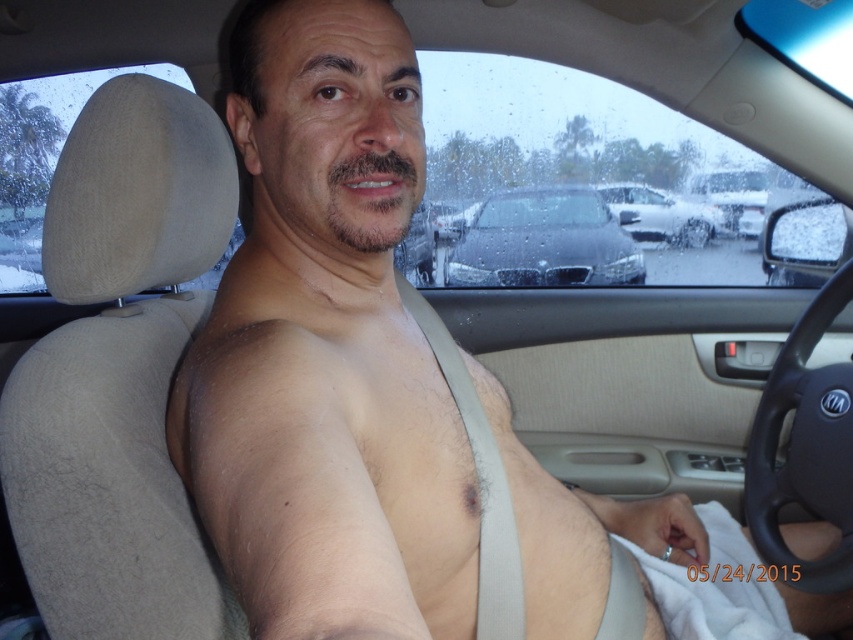
You are a passenger in a car and want to exit through the door on the driver side. There is a black metallic car at center and a white fabric at lower right. Which object is closer to the door handle?

The white fabric at lower right is closer to the door handle because the black metallic car at center is to the right of it, meaning the white fabric is positioned nearer to the door handle.

You are a delivery person who needs to load a package onto a cart that is 6 feet long. You see the white fabric at lower right and the silver metallic sedan at center. Can the cart fit between them without touching either?

The distance between the white fabric at lower right and the silver metallic sedan at center is 7.18 feet, which is greater than the cart length of 6 feet. Therefore, the cart can fit between them without touching either.

In the scene shown: You are a delivery robot positioned at the origin point. You need to navigate to the black metallic car at center. According to the coordinates provided in the Objects Description, what are the x and y coordinates you should aim for?

The black metallic car at center is located at point coordinates x 0.378 and y 0.640. So you should aim for x 0.378 and y 0.640 to reach the black metallic car at center.